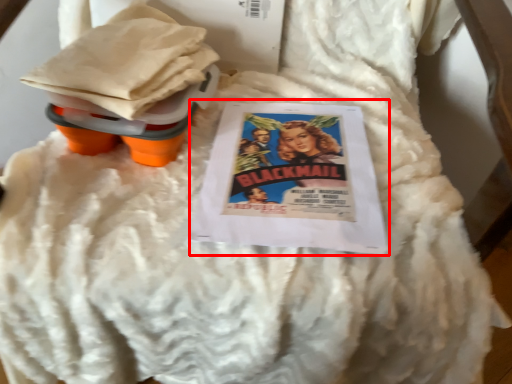
Question: From the image's perspective, where is comic book (annotated by the red box) located relative to toy?

Choices:
 (A) below
 (B) above

Answer: (A)